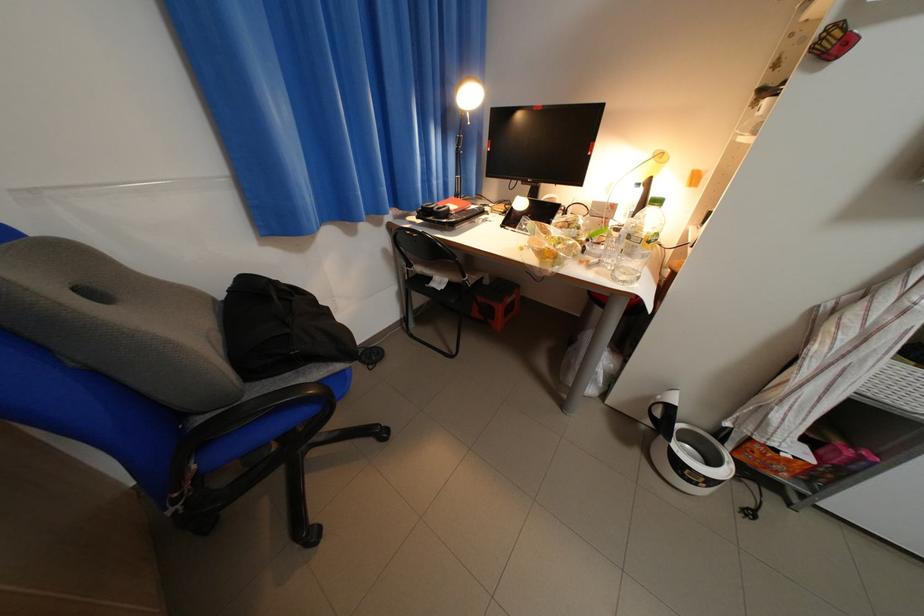
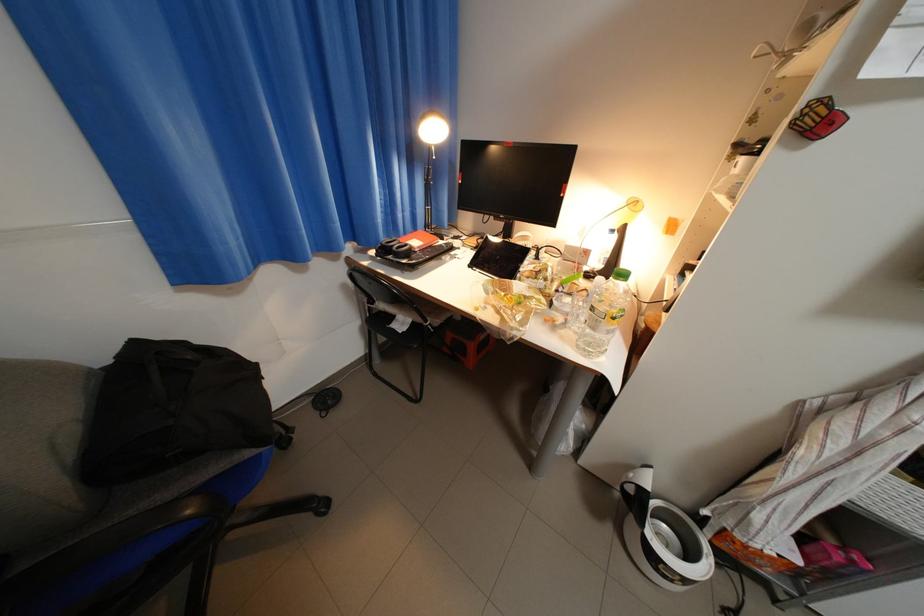
The point at (721,484) is marked in the first image. Where is the corresponding point in the second image?

(698, 582)